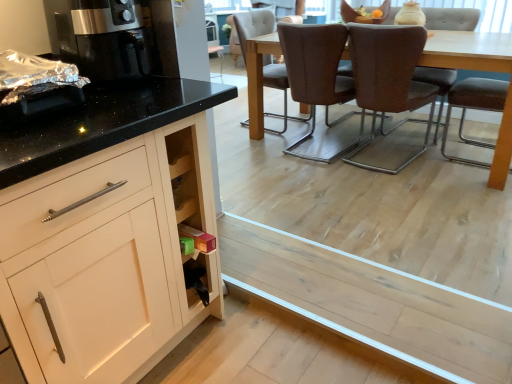
Question: Considering the positions of brown leather chair at center, the 1th chair when ordered from right to left, and light wood plank at lower center in the image, is brown leather chair at center, the 1th chair when ordered from right to left, wider or thinner than light wood plank at lower center?

Choices:
 (A) thin
 (B) wide

Answer: (B)

Question: In terms of height, does brown leather chair at center, the fifth chair when ordered from left to right, look taller or shorter compared to light wood plank at lower center?

Choices:
 (A) short
 (B) tall

Answer: (B)

Question: Which of these objects is positioned farthest from the brown fabric chair at center, the 1th chair positioned from the left?

Choices:
 (A) brown leather chair at center, the 2th chair when ordered from left to right
 (B) brown leather chair at center, the 1th chair when ordered from right to left
 (C) brown leather chair at center, the third chair positioned from the left
 (D) satin black coffee machine at left
 (E) light wood plank at lower center

Answer: (D)

Question: Which object is the closest to the brown fabric chair at center, the 1th chair positioned from the left?

Choices:
 (A) brown leather chair at center, the 2th chair when ordered from left to right
 (B) light wood plank at lower center
 (C) satin black coffee machine at left
 (D) brown leather chair at center, the 1th chair when ordered from right to left
 (E) brown leather chair at center, the third chair positioned from the left

Answer: (A)